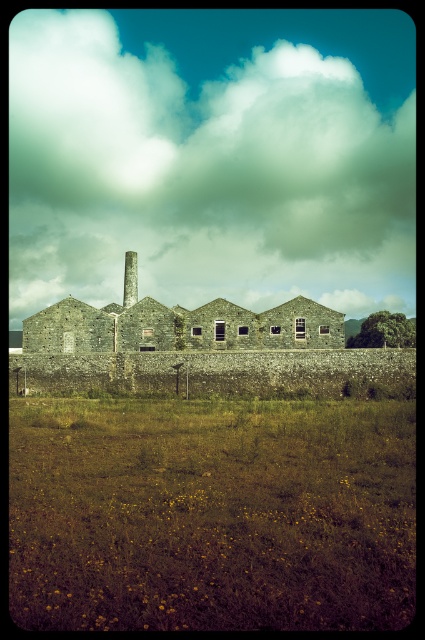
Can you confirm if white fluffy cloud at upper center is shorter than stone chimney at center?

In fact, white fluffy cloud at upper center may be taller than stone chimney at center.

Is white fluffy cloud at upper center above stone chimney at center?

Indeed, white fluffy cloud at upper center is positioned over stone chimney at center.

Where is `white fluffy cloud at upper center`? white fluffy cloud at upper center is located at coordinates (212, 156).

Which is above, green grass at lower center or stone chimney at center?

stone chimney at center is higher up.

Who is positioned more to the left, green grass at lower center or stone chimney at center?

stone chimney at center

Is point (345, 444) more distant than point (130, 262)?

No, (345, 444) is in front of (130, 262).

You are a GUI agent. You are given a task and a screenshot of the screen. Output one action in this format:
    pyautogui.click(x=<x>, y=<y>)
    Task: Click on the green grass at lower center
    
    Given the screenshot: What is the action you would take?
    pyautogui.click(x=212, y=513)

Who is more forward, (370, 131) or (268, 586)?

Point (268, 586)

Can you confirm if white fluffy cloud at upper center is smaller than green grass at lower center?

Actually, white fluffy cloud at upper center might be larger than green grass at lower center.

Where is `white fluffy cloud at upper center`? This screenshot has width=425, height=640. white fluffy cloud at upper center is located at coordinates (212, 156).